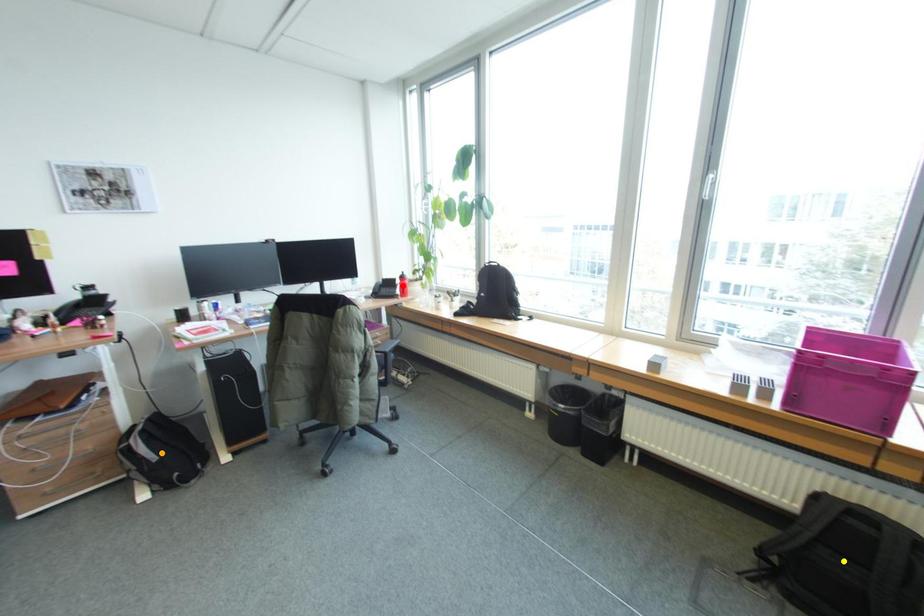
Order these from farthest to nearest:
A) orange point
B) red point
C) yellow point

red point < orange point < yellow point